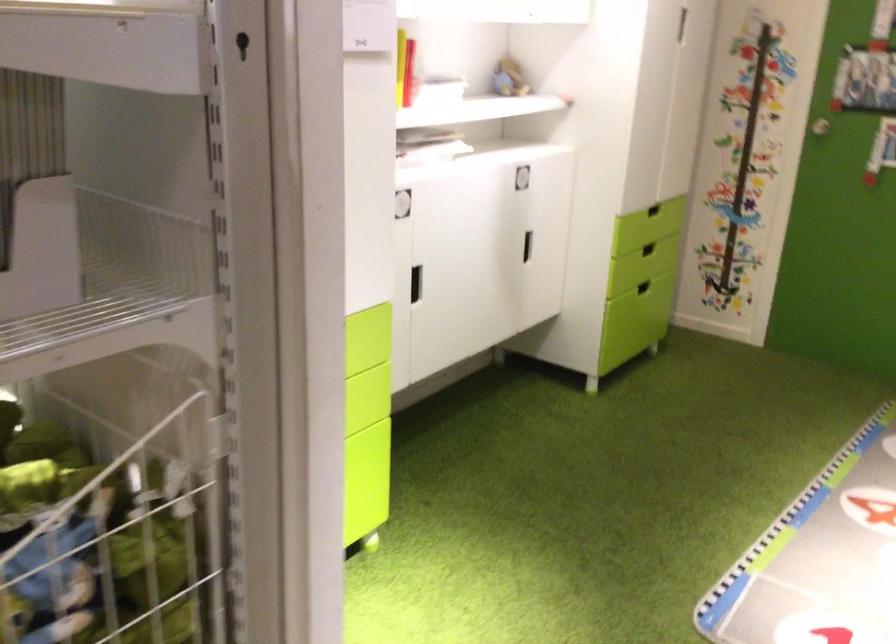
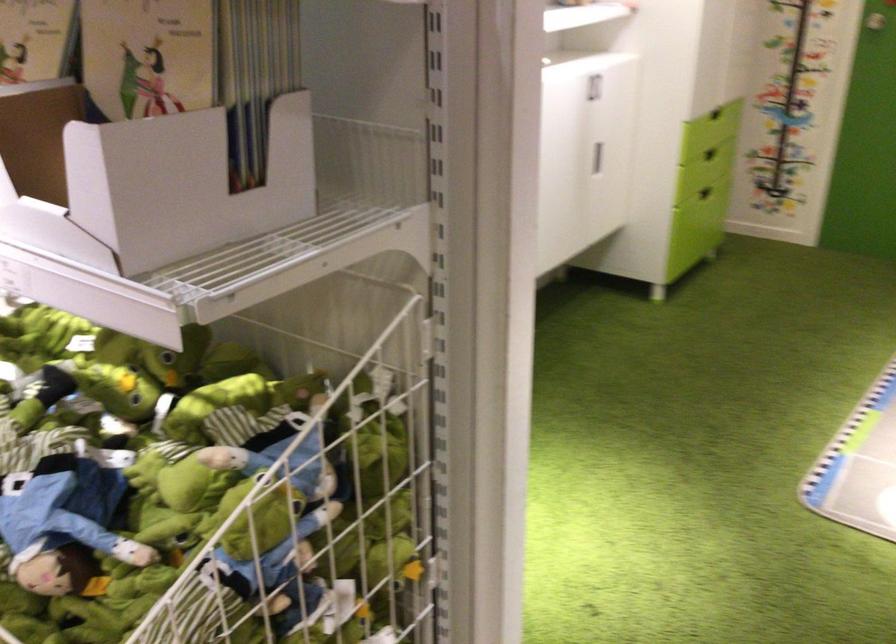
Find the pixel in the second image that matches (x=641, y=287) in the first image.

(704, 193)